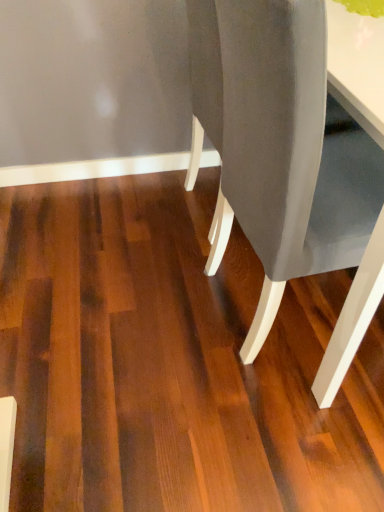
This screenshot has height=512, width=384. What do you see at coordinates (171, 362) in the screenshot?
I see `dark brown wood floor at center` at bounding box center [171, 362].

I want to click on dark brown wood floor at center, so click(171, 362).

Identify the location of matte gray chair at center. The image size is (384, 512). (264, 137).

What do you see at coordinates (264, 137) in the screenshot? I see `matte gray chair at center` at bounding box center [264, 137].

This screenshot has height=512, width=384. Identify the location of dark brown wood floor at center. (171, 362).

Considering the relative positions of dark brown wood floor at center and matte gray chair at center in the image provided, is dark brown wood floor at center to the right of matte gray chair at center from the viewer's perspective?

No.

Considering the positions of objects dark brown wood floor at center and matte gray chair at center in the image provided, who is in front, dark brown wood floor at center or matte gray chair at center?

matte gray chair at center.

Does point (48, 426) lie behind point (304, 151)?

Yes, it is.

From the image's perspective, does dark brown wood floor at center appear higher than matte gray chair at center?

No, from the image's perspective, dark brown wood floor at center is not on top of matte gray chair at center.

From a real-world perspective, is dark brown wood floor at center physically located above or below matte gray chair at center?

dark brown wood floor at center is below matte gray chair at center.

Which object is wider, dark brown wood floor at center or matte gray chair at center?

dark brown wood floor at center is wider.

Is dark brown wood floor at center shorter than matte gray chair at center?

Correct, dark brown wood floor at center is not as tall as matte gray chair at center.

Does dark brown wood floor at center have a smaller size compared to matte gray chair at center?

Yes.

Would you say dark brown wood floor at center is outside matte gray chair at center?

Yes, dark brown wood floor at center is located beyond the bounds of matte gray chair at center.

Does dark brown wood floor at center touch matte gray chair at center?

No, dark brown wood floor at center is not making contact with matte gray chair at center.

Could you tell me if dark brown wood floor at center is turned towards matte gray chair at center?

No.

Can you tell me how much dark brown wood floor at center and matte gray chair at center differ in facing direction?

89.6 degrees separate the facing orientations of dark brown wood floor at center and matte gray chair at center.

Consider the image. How far apart are dark brown wood floor at center and matte gray chair at center?

dark brown wood floor at center is 15.27 inches from matte gray chair at center.

Where is `chair that appears above the dark brown wood floor at center (from the image's perspective)`? The height and width of the screenshot is (512, 384). chair that appears above the dark brown wood floor at center (from the image's perspective) is located at coordinates (264, 137).

Is matte gray chair at center to the left or to the right of dark brown wood floor at center in the image?

Based on their positions, matte gray chair at center is located to the right of dark brown wood floor at center.

Which is behind, matte gray chair at center or dark brown wood floor at center?

dark brown wood floor at center is further away from the camera.

Which is closer to the camera, (289, 164) or (298, 372)?

The point (289, 164) is more forward.

From the image's perspective, would you say matte gray chair at center is shown under dark brown wood floor at center?

No, from the image's perspective, matte gray chair at center is not below dark brown wood floor at center.

From a real-world perspective, which is physically below, matte gray chair at center or dark brown wood floor at center?

From a 3D spatial view, dark brown wood floor at center is below.

Considering the relative sizes of matte gray chair at center and dark brown wood floor at center in the image provided, is matte gray chair at center thinner than dark brown wood floor at center?

Yes.

Who is taller, matte gray chair at center or dark brown wood floor at center?

With more height is matte gray chair at center.

In terms of size, does matte gray chair at center appear bigger or smaller than dark brown wood floor at center?

matte gray chair at center is bigger than dark brown wood floor at center.

Is matte gray chair at center completely or partially outside of dark brown wood floor at center?

matte gray chair at center is positioned outside dark brown wood floor at center.

Is matte gray chair at center not close to dark brown wood floor at center?

No, matte gray chair at center is not far away from dark brown wood floor at center.

Does matte gray chair at center turn towards dark brown wood floor at center?

No, matte gray chair at center is not oriented towards dark brown wood floor at center.

Locate an element on the screen. chair that appears in front of the dark brown wood floor at center is located at coordinates (264, 137).

The width and height of the screenshot is (384, 512). Find the location of `plywood below the matte gray chair at center (from a real-world perspective)`. plywood below the matte gray chair at center (from a real-world perspective) is located at coordinates (171, 362).

This screenshot has width=384, height=512. I want to click on plywood lying below the matte gray chair at center (from the image's perspective), so click(171, 362).